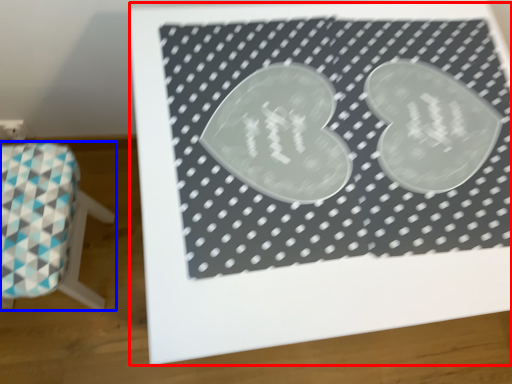
Question: Among these objects, which one is farthest to the camera, bulletin board (highlighted by a red box) or furniture (highlighted by a blue box)?

Choices:
 (A) bulletin board
 (B) furniture

Answer: (B)